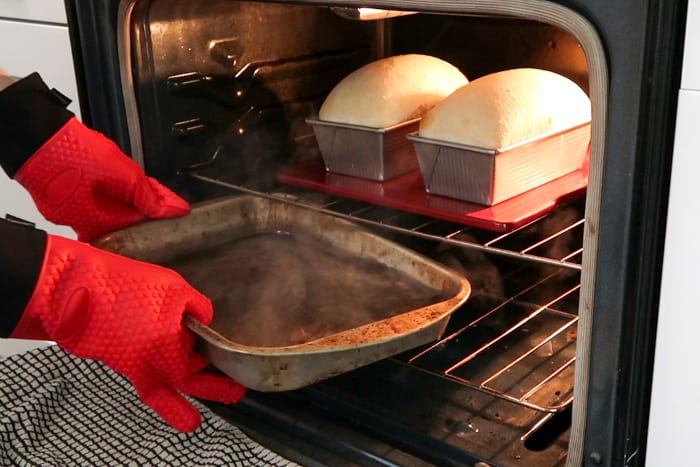
The width and height of the screenshot is (700, 467). Identify the location of oven. (522, 254).